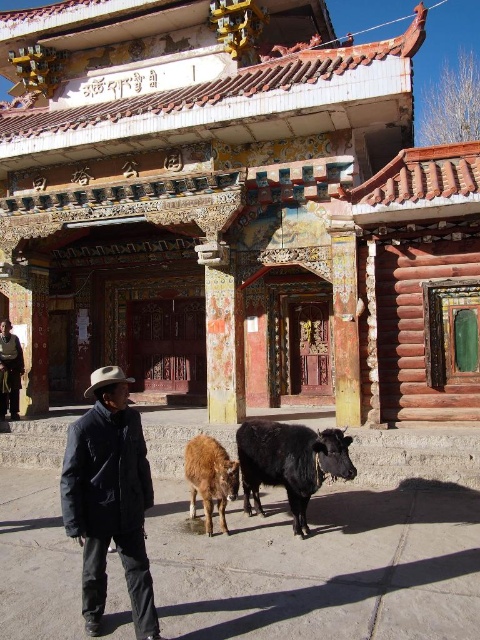
Question: Is brown furry bull at lower center below white felt cowboy hat at center?

Choices:
 (A) yes
 (B) no

Answer: (A)

Question: Does dark brown leather jacket at left come in front of white felt cowboy hat at center?

Choices:
 (A) no
 (B) yes

Answer: (A)

Question: Estimate the real-world distances between objects in this image. Which object is closer to the black glossy bull at lower center?

Choices:
 (A) dark brown leather jacket at left
 (B) white felt cowboy hat at center
 (C) dark blue puffy jacket at center

Answer: (C)

Question: Which of the following is the closest to the observer?

Choices:
 (A) black glossy bull at lower center
 (B) dark brown leather jacket at left

Answer: (A)

Question: Is black glossy bull at lower center below dark brown leather jacket at left?

Choices:
 (A) yes
 (B) no

Answer: (A)

Question: Which of the following is the closest to the observer?

Choices:
 (A) dark blue puffy jacket at center
 (B) black glossy bull at lower center
 (C) white felt cowboy hat at center
 (D) brown furry bull at lower center

Answer: (A)